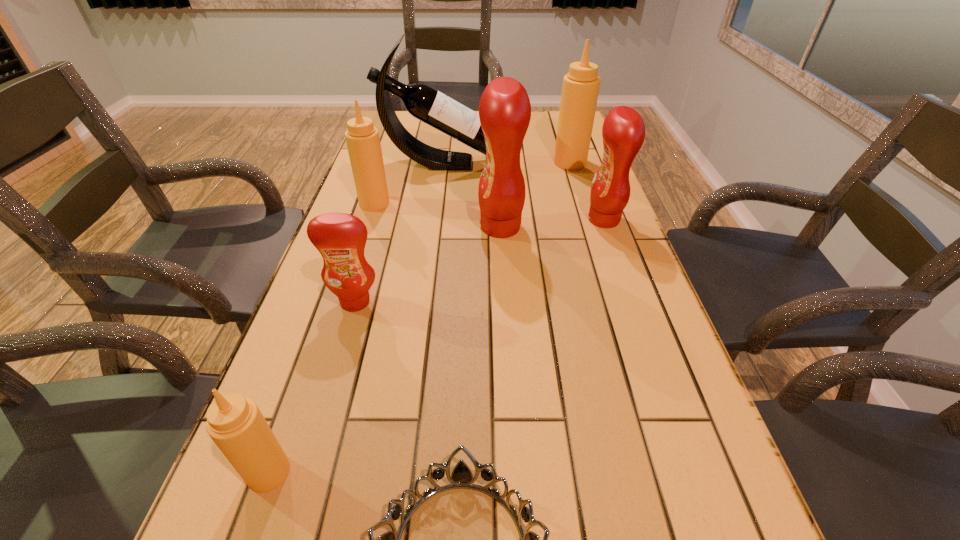
You are a GUI agent. You are given a task and a screenshot of the screen. Output one action in this format:
    pyautogui.click(x=<x>, y=<y>)
    Task: Click on the vacant space situated 0.150m on the label side of the smallest red condiment
    This screenshot has width=960, height=540.
    Given the screenshot: What is the action you would take?
    pyautogui.click(x=335, y=371)

Locate an element on the screen. This screenshot has width=960, height=540. vacant region located 0.360m on the back of the smallest tan condiment is located at coordinates (330, 299).

Image resolution: width=960 pixels, height=540 pixels. I want to click on wine bottle situated at the left edge, so click(x=423, y=102).

At what (x,y) coordinates should I click in order to perform the action: click on vacant space at the far edge of the desktop. Please return your answer as a coordinate pair (x, y). Looking at the image, I should click on (434, 134).

Locate an element on the screen. vacant space at the left edge is located at coordinates (354, 332).

Locate an element on the screen. The image size is (960, 540). blank area at the right edge is located at coordinates tap(588, 241).

This screenshot has width=960, height=540. I want to click on empty space between the smallest tan condiment and the nearest red condiment, so click(312, 387).

The width and height of the screenshot is (960, 540). I want to click on blank region between the rightmost red condiment and the rightmost tan condiment, so click(587, 191).

This screenshot has height=540, width=960. In order to click on vacant space in between the third condiment from right to left and the nearest red condiment in this screenshot , I will do `click(428, 265)`.

The width and height of the screenshot is (960, 540). Identify the location of unoccupied position between the nearest tan condiment and the black wine bottle. (355, 318).